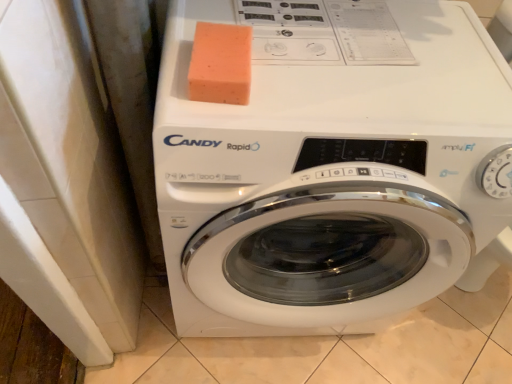
I want to click on vacant area that lies to the right of orange sponge at upper center, so click(319, 79).